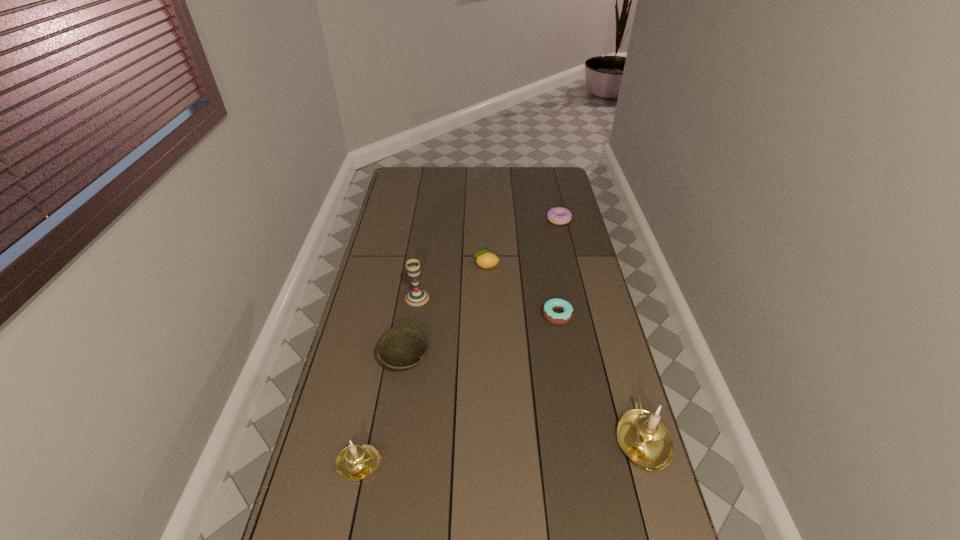
Where is `free space between the shortest object and the second farthest object`? The height and width of the screenshot is (540, 960). free space between the shortest object and the second farthest object is located at coordinates pos(521,290).

At what (x,y) coordinates should I click in order to perform the action: click on vacant area between the chalice and the shorter candle holder. Please return your answer as a coordinate pair (x, y). The width and height of the screenshot is (960, 540). Looking at the image, I should click on [x=390, y=381].

You are a GUI agent. You are given a task and a screenshot of the screen. Output one action in this format:
    pyautogui.click(x=<x>, y=<y>)
    Task: Click on the unoccupied position between the shorter candle holder and the right candle holder
    The width and height of the screenshot is (960, 540).
    Given the screenshot: What is the action you would take?
    pyautogui.click(x=502, y=450)

You are a GUI agent. You are given a task and a screenshot of the screen. Output one action in this format:
    pyautogui.click(x=<x>, y=<y>)
    Task: Click on the empty space between the farther doughnut and the second farthest object
    This screenshot has height=540, width=960.
    Given the screenshot: What is the action you would take?
    pyautogui.click(x=522, y=242)

The height and width of the screenshot is (540, 960). I want to click on free space between the right candle holder and the shortest object, so click(x=600, y=376).

I want to click on empty space that is in between the fourth object from left to right and the right candle holder, so (x=564, y=352).

Identify the location of blank region between the right candle holder and the shorter candle holder. Image resolution: width=960 pixels, height=540 pixels. (502, 450).

The height and width of the screenshot is (540, 960). I want to click on free space between the farther doughnut and the shortest object, so click(558, 267).

The image size is (960, 540). What are the coordinates of `vacant area between the right candle holder and the lemon` in the screenshot? It's located at (564, 352).

At what (x,y) coordinates should I click in order to perform the action: click on unoccupied position between the lemon and the farthest object. Please return your answer as a coordinate pair (x, y). The height and width of the screenshot is (540, 960). Looking at the image, I should click on (522, 242).